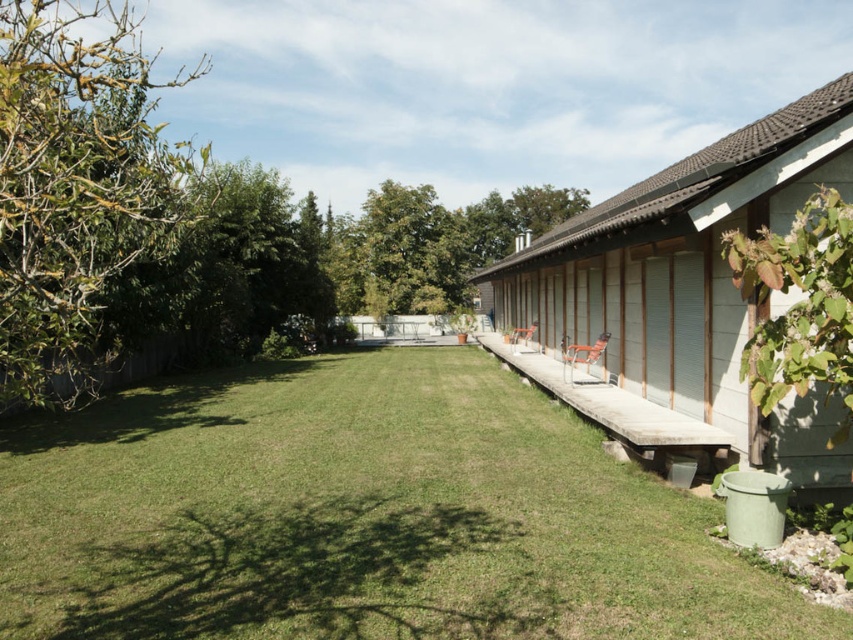
You are planning to install a new sprinkler system in the backyard. The sprinkler needs to cover the area of the green grass at center and the white wood hut at right. Based on their heights, which area might require a taller sprinkler head to ensure adequate watering?

The white wood hut at right requires a taller sprinkler head because it is taller than the green grass at center, so the sprinkler must reach higher to water it properly.